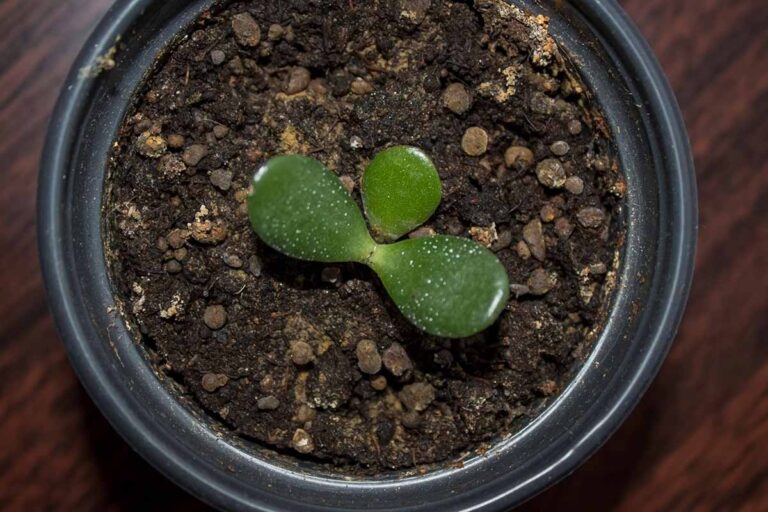
Where is `wood tabletop to right of pot`? wood tabletop to right of pot is located at coordinates (743, 245).